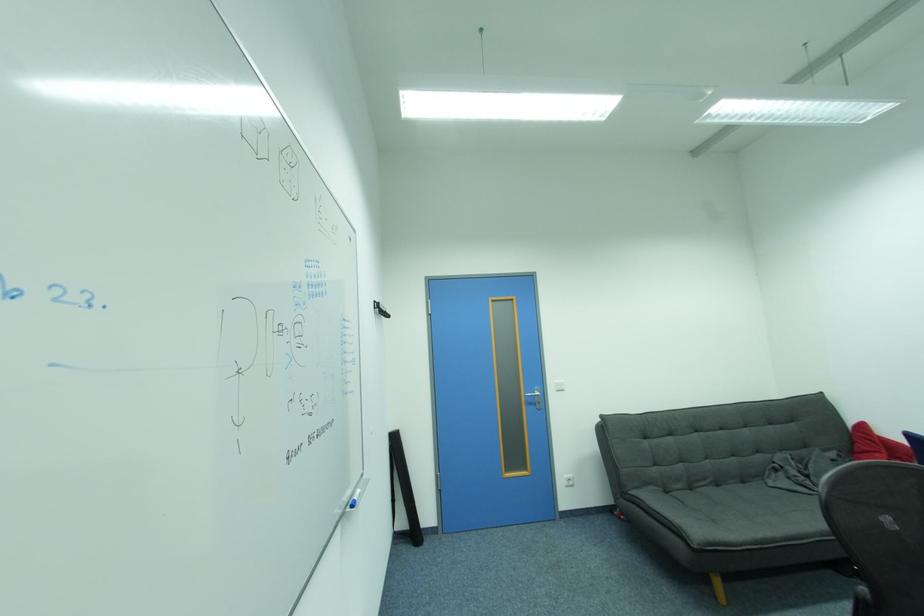
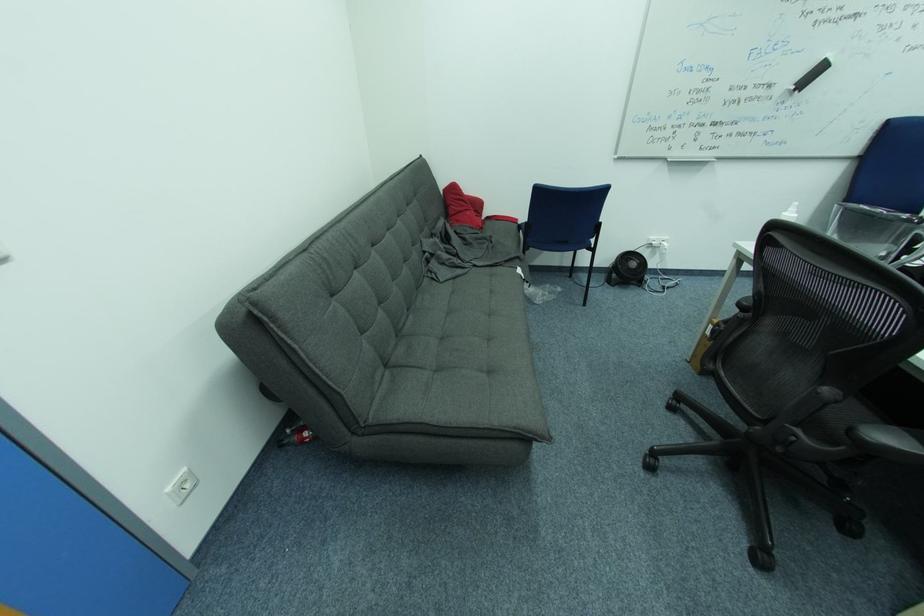
In the second image, find the point that corresponds to pixel 723 487 in the first image.

(415, 312)